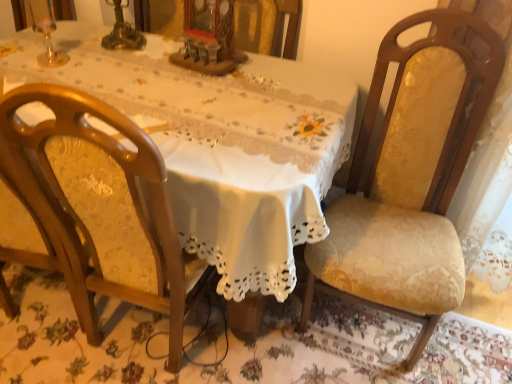
Question: Is wooden chair at left, which ranks as the 2th chair in right-to-left order, taller than velvet yellow chair at right, marked as the 1th chair in a right-to-left arrangement?

Choices:
 (A) yes
 (B) no

Answer: (A)

Question: From a real-world perspective, is wooden chair at left, which ranks as the 2th chair in right-to-left order, physically below velvet yellow chair at right, marked as the 1th chair in a right-to-left arrangement?

Choices:
 (A) no
 (B) yes

Answer: (B)

Question: Can velvet yellow chair at right, the second chair from the left, be found inside wooden chair at left, which ranks as the 2th chair in right-to-left order?

Choices:
 (A) yes
 (B) no

Answer: (B)

Question: Is wooden chair at left, acting as the 1th chair starting from the left, located outside velvet yellow chair at right, marked as the 1th chair in a right-to-left arrangement?

Choices:
 (A) no
 (B) yes

Answer: (B)

Question: Does wooden chair at left, which ranks as the 2th chair in right-to-left order, come in front of velvet yellow chair at right, the second chair from the left?

Choices:
 (A) yes
 (B) no

Answer: (A)

Question: Is wooden chair at left, acting as the 1th chair starting from the left, positioned with its back to velvet yellow chair at right, marked as the 1th chair in a right-to-left arrangement?

Choices:
 (A) yes
 (B) no

Answer: (B)

Question: Is wooden chair at left, which ranks as the 2th chair in right-to-left order, located within velvet yellow chair at right, the second chair from the left?

Choices:
 (A) yes
 (B) no

Answer: (B)

Question: Can you confirm if velvet yellow chair at right, marked as the 1th chair in a right-to-left arrangement, is bigger than wooden chair at left, which ranks as the 2th chair in right-to-left order?

Choices:
 (A) yes
 (B) no

Answer: (A)

Question: From the image's perspective, would you say velvet yellow chair at right, marked as the 1th chair in a right-to-left arrangement, is positioned over wooden chair at left, which ranks as the 2th chair in right-to-left order?

Choices:
 (A) no
 (B) yes

Answer: (B)

Question: Is velvet yellow chair at right, marked as the 1th chair in a right-to-left arrangement, further to camera compared to wooden chair at left, acting as the 1th chair starting from the left?

Choices:
 (A) yes
 (B) no

Answer: (A)

Question: Is velvet yellow chair at right, marked as the 1th chair in a right-to-left arrangement, turned away from wooden chair at left, acting as the 1th chair starting from the left?

Choices:
 (A) no
 (B) yes

Answer: (A)

Question: Considering the relative sizes of velvet yellow chair at right, the second chair from the left, and wooden chair at left, acting as the 1th chair starting from the left, in the image provided, is velvet yellow chair at right, the second chair from the left, shorter than wooden chair at left, acting as the 1th chair starting from the left,?

Choices:
 (A) no
 (B) yes

Answer: (B)

Question: Is wooden chair at left, acting as the 1th chair starting from the left, to the left of white lace tablecloth at center from the viewer's perspective?

Choices:
 (A) yes
 (B) no

Answer: (B)